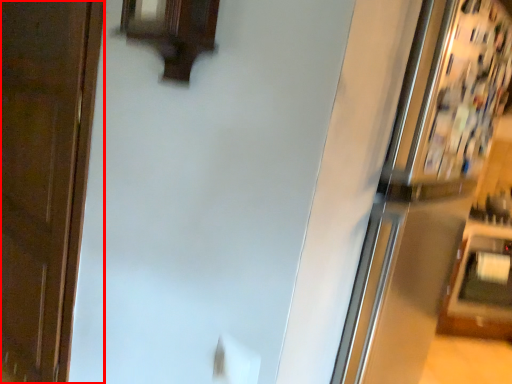
Question: From the image's perspective, what is the correct spatial relationship of door (annotated by the red box) in relation to fridge?

Choices:
 (A) below
 (B) above

Answer: (B)